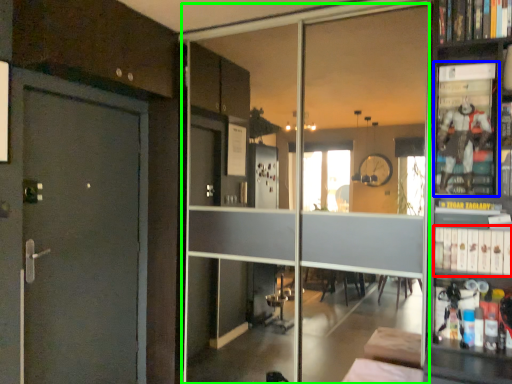
Question: Considering the real-world distances, which object is closest to book (highlighted by a red box)? shelf (highlighted by a blue box) or glass door (highlighted by a green box).

Choices:
 (A) shelf
 (B) glass door

Answer: (A)